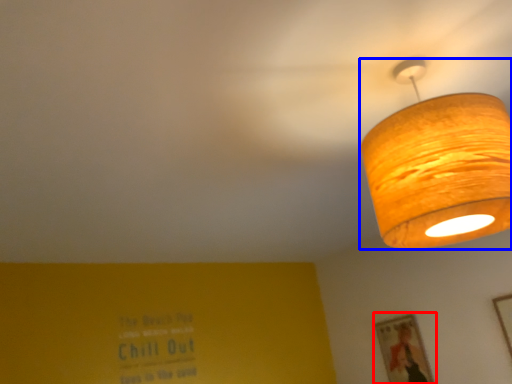
Question: Among these objects, which one is nearest to the camera, picture frame (highlighted by a red box) or lamp (highlighted by a blue box)?

Choices:
 (A) picture frame
 (B) lamp

Answer: (B)